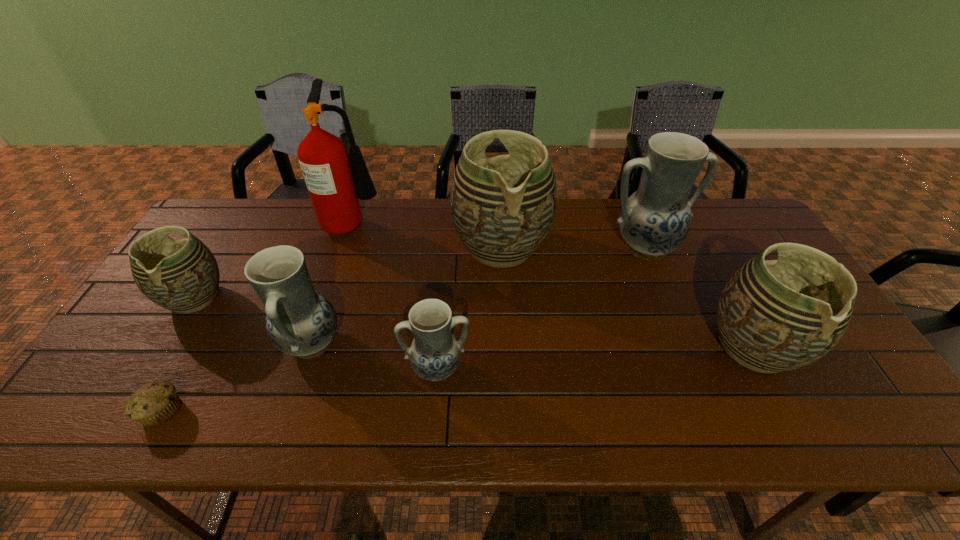
Identify the location of red fire extinguisher. (323, 157).

This screenshot has height=540, width=960. In order to click on the tallest object in this screenshot , I will do click(x=323, y=157).

This screenshot has width=960, height=540. I want to click on the biggest blue pottery, so click(x=655, y=220).

Locate an element on the screen. The width and height of the screenshot is (960, 540). the farthest blue pottery is located at coordinates point(655,220).

What are the coordinates of `the biggest brown pottery` in the screenshot? It's located at (502, 208).

This screenshot has width=960, height=540. In order to click on the second biggest brown pottery in this screenshot , I will do `click(773, 316)`.

Locate an element on the screen. Image resolution: width=960 pixels, height=540 pixels. the second smallest blue pottery is located at coordinates tap(300, 321).

The height and width of the screenshot is (540, 960). What are the coordinates of `the second pottery from left to right` in the screenshot? It's located at (300, 321).

The width and height of the screenshot is (960, 540). I want to click on the second blue pottery from right to left, so click(x=434, y=354).

The height and width of the screenshot is (540, 960). Find the location of `the leftmost pottery`. the leftmost pottery is located at coordinates (183, 276).